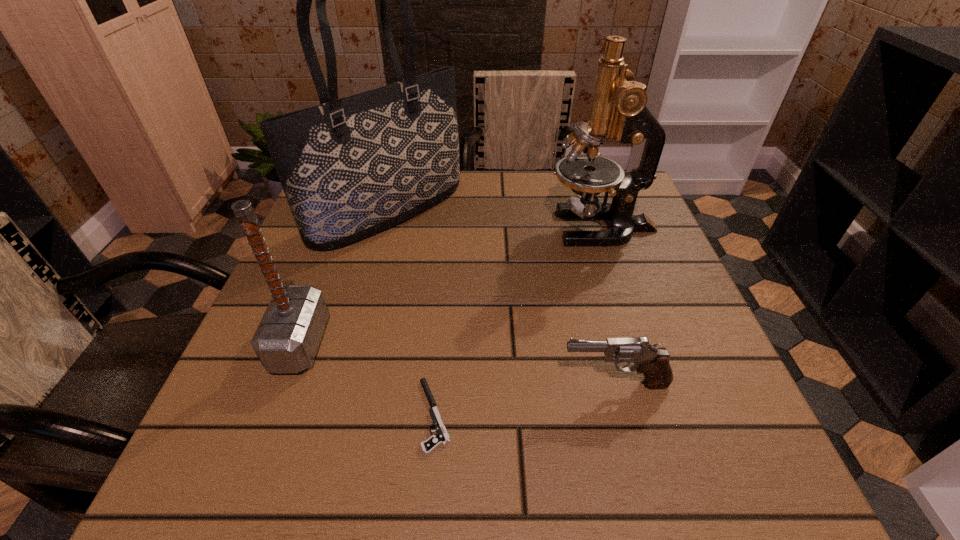
You are a GUI agent. You are given a task and a screenshot of the screen. Output one action in this format:
    pyautogui.click(x=<x>, y=<y>)
    Task: Click on the free space located at the eyepiece of the microscope
    
    Given the screenshot: What is the action you would take?
    pyautogui.click(x=410, y=227)

The image size is (960, 540). What are the coordinates of `blank space located 0.200m on the striking surface of the third tallest object` in the screenshot? It's located at (436, 343).

Locate an element on the screen. The image size is (960, 540). vacant space located 0.330m at the barrel of the taller pistol is located at coordinates (357, 383).

Where is `free space located at the barrel of the taller pistol`? free space located at the barrel of the taller pistol is located at coordinates (413, 383).

Image resolution: width=960 pixels, height=540 pixels. In order to click on vacant space located 0.280m at the barrel of the taller pistol in this screenshot , I will do `click(388, 383)`.

Where is `free space located on the front-facing side of the shortest object`? This screenshot has height=540, width=960. free space located on the front-facing side of the shortest object is located at coordinates (274, 415).

Identify the location of vacant space located on the front-facing side of the shortest object. The image size is (960, 540). (351, 415).

Find the location of a particular element. This screenshot has height=540, width=960. blank area located on the front-facing side of the shortest object is located at coordinates (364, 415).

Locate an element on the screen. The height and width of the screenshot is (540, 960). tote bag located in the far edge section of the desktop is located at coordinates (352, 167).

Find the location of a particular element. microscope that is at the far edge is located at coordinates (618, 109).